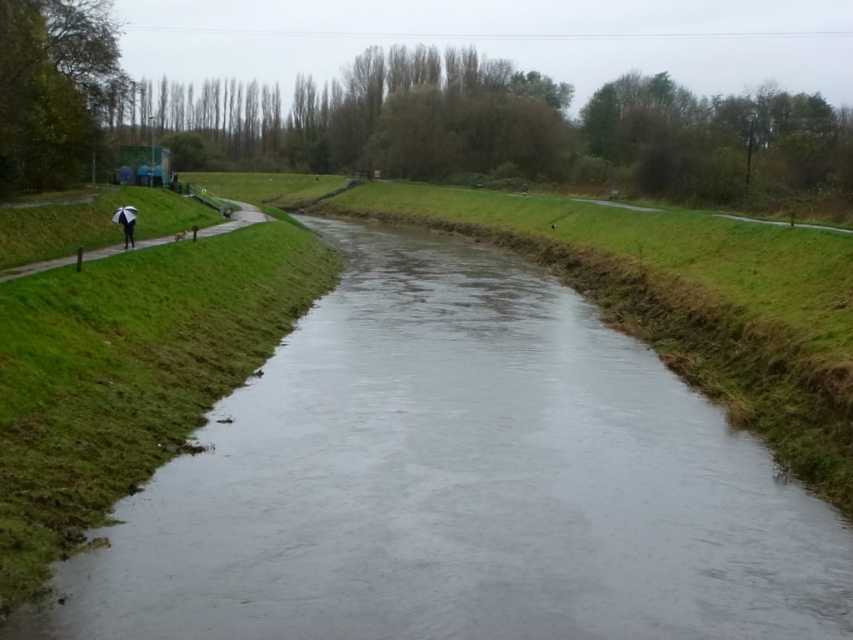
Question: Does clear water at center have a smaller size compared to white umbrella at left?

Choices:
 (A) yes
 (B) no

Answer: (A)

Question: Which of the following is the closest to the observer?

Choices:
 (A) (613, 560)
 (B) (254, 216)

Answer: (A)

Question: Which point is farther from the camera taking this photo?

Choices:
 (A) coord(218,628)
 (B) coord(73,259)

Answer: (B)

Question: Is clear water at center above white umbrella at left?

Choices:
 (A) yes
 (B) no

Answer: (B)

Question: Which of the following is the farthest from the observer?

Choices:
 (A) white umbrella at left
 (B) clear water at center

Answer: (A)

Question: Does clear water at center appear over white umbrella at left?

Choices:
 (A) no
 (B) yes

Answer: (A)